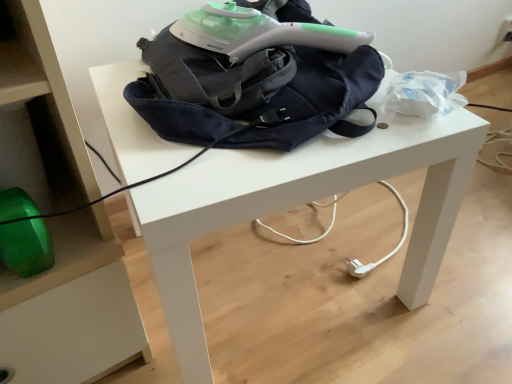
Question: Is white matte table at center in front of or behind denim backpack at center in the image?

Choices:
 (A) front
 (B) behind

Answer: (A)

Question: Looking at the image, does white matte table at center seem bigger or smaller compared to denim backpack at center?

Choices:
 (A) big
 (B) small

Answer: (A)

Question: From the image's perspective, relative to denim backpack at center, is white matte table at center above or below?

Choices:
 (A) below
 (B) above

Answer: (A)

Question: Is denim backpack at center in front of or behind white matte table at center in the image?

Choices:
 (A) front
 (B) behind

Answer: (B)

Question: Is denim backpack at center bigger or smaller than white matte table at center?

Choices:
 (A) big
 (B) small

Answer: (B)

Question: From the image's perspective, is denim backpack at center above or below white matte table at center?

Choices:
 (A) below
 (B) above

Answer: (B)

Question: Is point (262, 57) closer or farther from the camera than point (134, 172)?

Choices:
 (A) farther
 (B) closer

Answer: (A)